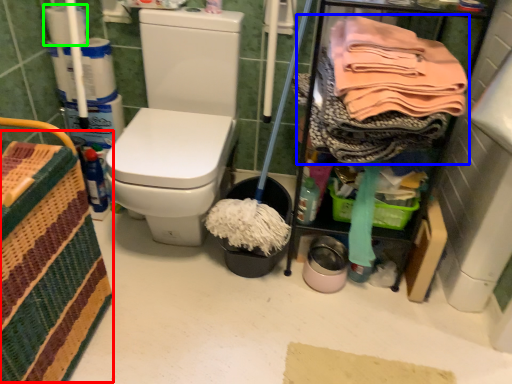
Question: Based on their relative distances, which object is farther from basket (highlighted by a red box)? Choose from clothing (highlighted by a blue box) and toilet paper (highlighted by a green box).

Choices:
 (A) clothing
 (B) toilet paper

Answer: (B)